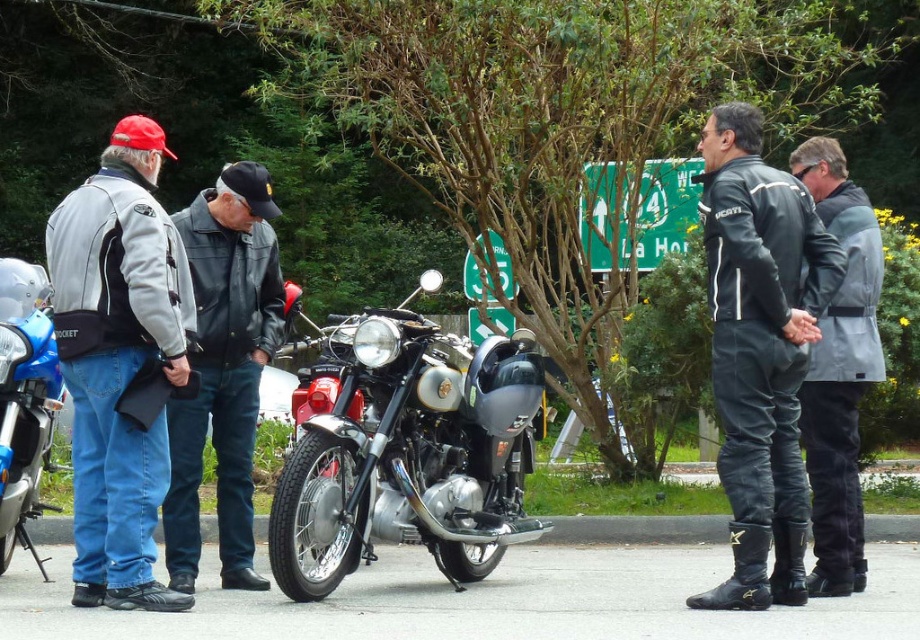
You are a photographer trying to capture a group photo of the two individuals wearing black leather jackets. Since you want to frame them properly, can you determine if the black leather jacket at right is positioned to the right side of the black leather jacket at left?

The black leather jacket at right is to the right of the black leather jacket at left, so yes, the black leather jacket at right is positioned to the right side of the black leather jacket at left.

You are a photographer standing behind the vintage motorcycle in the center. You want to take a photo that includes both the black leather jacket at right and the black leather jacket at left. What is the minimum distance you need to move backward to ensure both are in frame?

The two black leather jackets are 2.87 meters apart. To include both in the frame, you need to move back at least 2.87 meters so the camera can capture the entire distance between them.